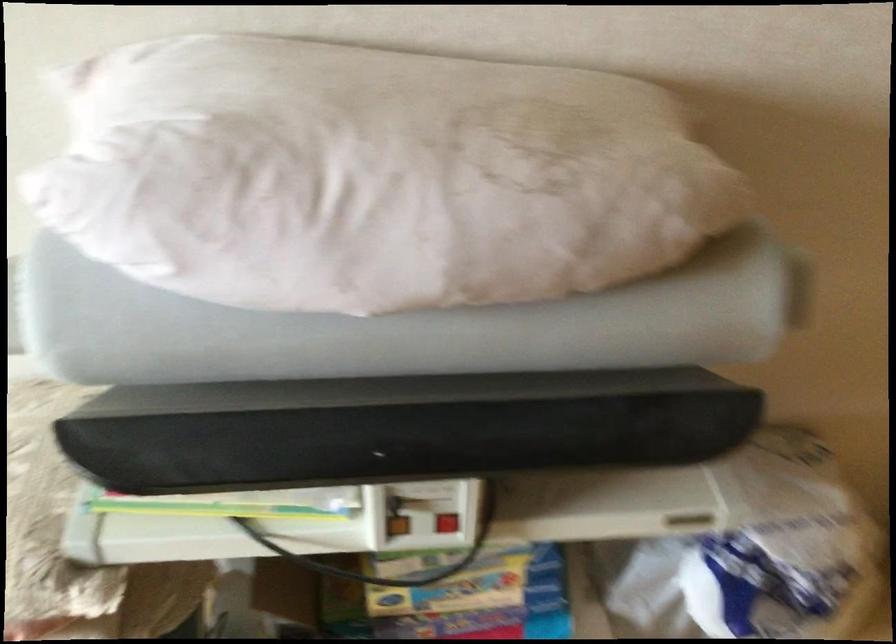
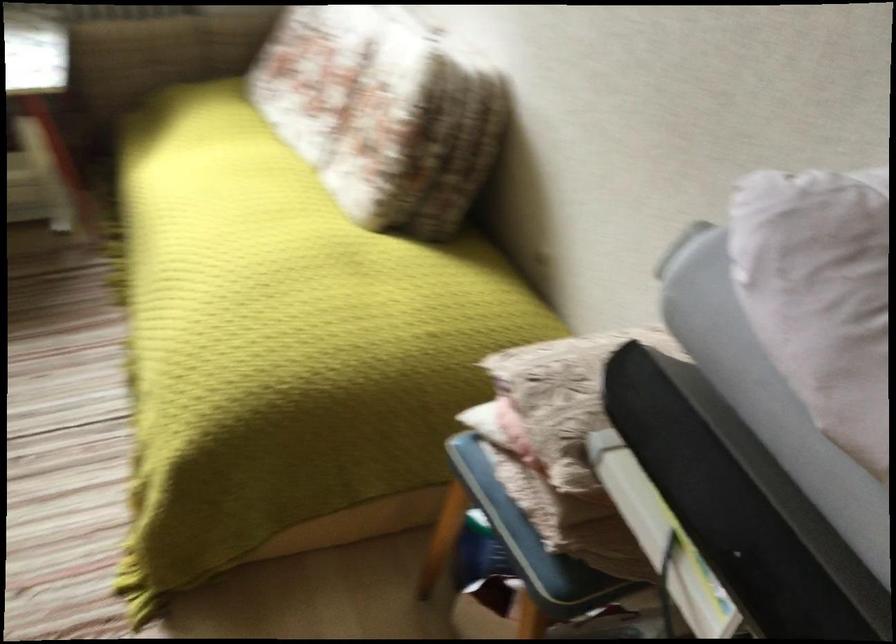
Looking at this image, the images are taken continuously from a first-person perspective. In which direction is your viewpoint rotating?

The rotation direction of the camera is left-down.